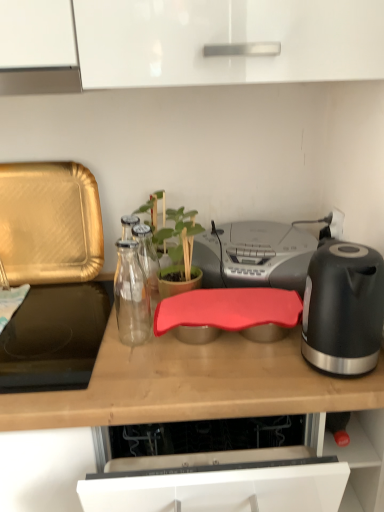
Question: From a real-world perspective, is gray plastic stereo at center positioned under rubberized red cutting board at center based on gravity?

Choices:
 (A) no
 (B) yes

Answer: (A)

Question: Does gray plastic stereo at center lie in front of rubberized red cutting board at center?

Choices:
 (A) no
 (B) yes

Answer: (A)

Question: Considering the relative positions of gray plastic stereo at center and rubberized red cutting board at center in the image provided, is gray plastic stereo at center to the left of rubberized red cutting board at center from the viewer's perspective?

Choices:
 (A) yes
 (B) no

Answer: (B)

Question: Does gray plastic stereo at center have a greater width compared to rubberized red cutting board at center?

Choices:
 (A) no
 (B) yes

Answer: (A)

Question: From the image's perspective, does gray plastic stereo at center appear lower than rubberized red cutting board at center?

Choices:
 (A) no
 (B) yes

Answer: (A)

Question: Considering the relative sizes of gray plastic stereo at center and rubberized red cutting board at center in the image provided, is gray plastic stereo at center taller than rubberized red cutting board at center?

Choices:
 (A) no
 (B) yes

Answer: (A)

Question: Does rubberized red cutting board at center have a larger size compared to black matte electric kettle at right?

Choices:
 (A) no
 (B) yes

Answer: (B)

Question: Is rubberized red cutting board at center facing towards black matte electric kettle at right?

Choices:
 (A) yes
 (B) no

Answer: (B)

Question: Is rubberized red cutting board at center turned away from black matte electric kettle at right?

Choices:
 (A) no
 (B) yes

Answer: (A)

Question: Can we say rubberized red cutting board at center lies outside black matte electric kettle at right?

Choices:
 (A) no
 (B) yes

Answer: (B)

Question: Does rubberized red cutting board at center lie in front of black matte electric kettle at right?

Choices:
 (A) no
 (B) yes

Answer: (B)

Question: From a real-world perspective, is rubberized red cutting board at center under black matte electric kettle at right?

Choices:
 (A) yes
 (B) no

Answer: (A)

Question: From the image's perspective, does gold textured tray at left appear lower than rubberized red cutting board at center?

Choices:
 (A) no
 (B) yes

Answer: (A)